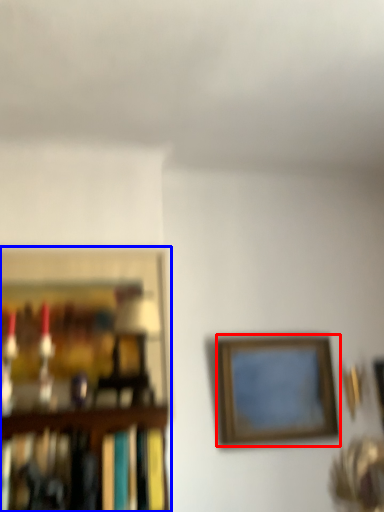
Question: Which object appears farthest to the camera in this image, picture frame (highlighted by a red box) or picture frame (highlighted by a blue box)?

Choices:
 (A) picture frame
 (B) picture frame

Answer: (A)